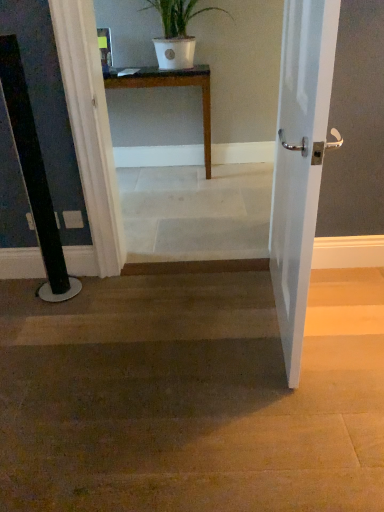
Question: Should I look upward or downward to see white marble stairs at center?

Choices:
 (A) up
 (B) down

Answer: (A)

Question: From the image's perspective, does white glossy door at right appear higher than white marble stairs at center?

Choices:
 (A) yes
 (B) no

Answer: (B)

Question: Is white glossy door at right positioned before white marble stairs at center?

Choices:
 (A) no
 (B) yes

Answer: (B)

Question: Considering the relative positions of white glossy door at right and white marble stairs at center in the image provided, is white glossy door at right to the right of white marble stairs at center from the viewer's perspective?

Choices:
 (A) yes
 (B) no

Answer: (A)

Question: Is white glossy door at right behind white marble stairs at center?

Choices:
 (A) no
 (B) yes

Answer: (A)

Question: From the image's perspective, is white glossy door at right below white marble stairs at center?

Choices:
 (A) no
 (B) yes

Answer: (B)

Question: Could you tell me if white glossy door at right is facing white marble stairs at center?

Choices:
 (A) yes
 (B) no

Answer: (A)

Question: Is white marble stairs at center positioned in front of white glossy door at right?

Choices:
 (A) no
 (B) yes

Answer: (A)

Question: Is white marble stairs at center further to the viewer compared to white glossy door at right?

Choices:
 (A) no
 (B) yes

Answer: (B)

Question: Considering the relative positions of white marble stairs at center and white glossy door at right in the image provided, is white marble stairs at center to the right of white glossy door at right from the viewer's perspective?

Choices:
 (A) no
 (B) yes

Answer: (A)

Question: From the image's perspective, is white marble stairs at center above white glossy door at right?

Choices:
 (A) yes
 (B) no

Answer: (A)

Question: Is white marble stairs at center bigger than white glossy door at right?

Choices:
 (A) no
 (B) yes

Answer: (B)

Question: Can you confirm if white marble stairs at center is shorter than white glossy door at right?

Choices:
 (A) no
 (B) yes

Answer: (A)

Question: Is white matte pot at upper center not near white marble stairs at center?

Choices:
 (A) no
 (B) yes

Answer: (A)